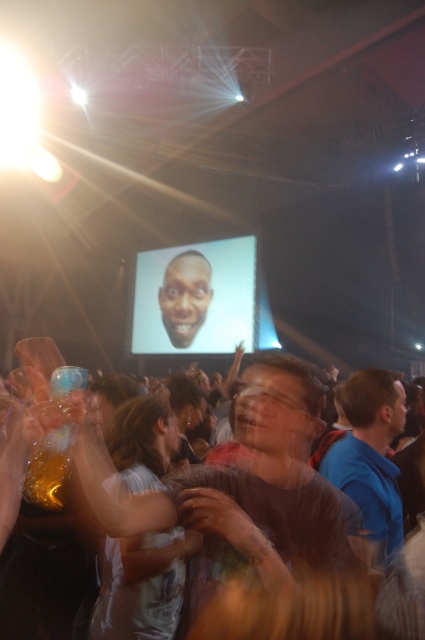
Question: Is matte brown shirt at center wider than matte plastic screen at center?

Choices:
 (A) yes
 (B) no

Answer: (B)

Question: Which is farther from the matte plastic screen at center?

Choices:
 (A) white cotton shirt at center
 (B) blue fabric shirt at right

Answer: (A)

Question: Is white cotton shirt at center closer to the viewer compared to blue fabric shirt at right?

Choices:
 (A) no
 (B) yes

Answer: (B)

Question: Which object appears farthest from the camera in this image?

Choices:
 (A) matte plastic screen at center
 (B) translucent plastic bag at center
 (C) blue fabric shirt at right
 (D) white cotton shirt at center

Answer: (A)

Question: Which point is closer to the camera?

Choices:
 (A) coord(133,412)
 (B) coord(379,557)

Answer: (B)

Question: Is matte plastic screen at center smaller than blue fabric shirt at right?

Choices:
 (A) no
 (B) yes

Answer: (A)